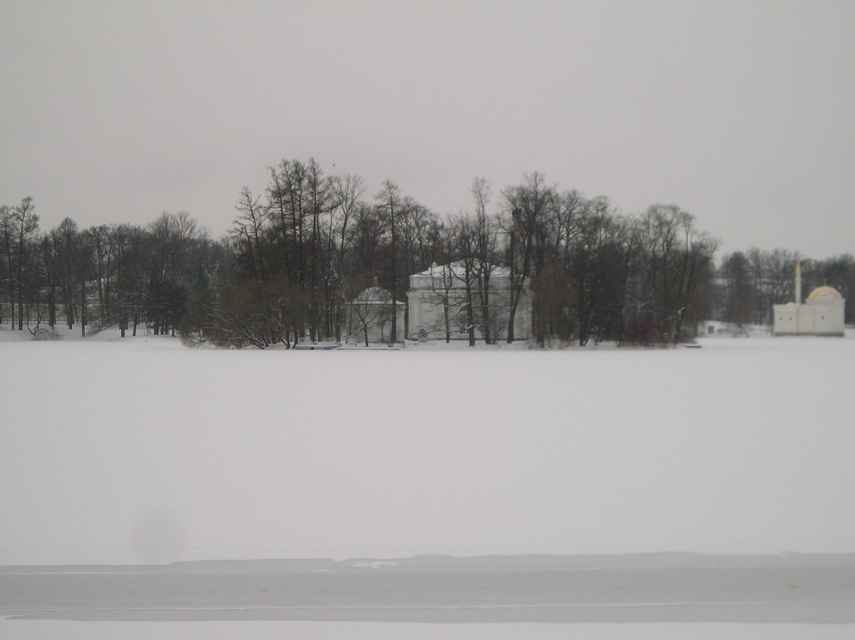
You are an observer standing in the winter landscape. You see the white matte snow at center and the brown leafless tree at center. Which object is closer to you?

The white matte snow at center is closer to you because it is in front of the brown leafless tree at center.

You are an observer standing in the winter landscape. You see the white matte snow at center and the brown leafless tree at center. Which object is located to the right?

The brown leafless tree at center is located to the right of the white matte snow at center.

You are an observer standing at the edge of the snowy landscape. You notice the white matte snow at center and the brown leafless tree at center. Which object appears to have a smaller vertical dimension?

The white matte snow at center is thinner than the brown leafless tree at center, so the white matte snow at center has a smaller vertical dimension.